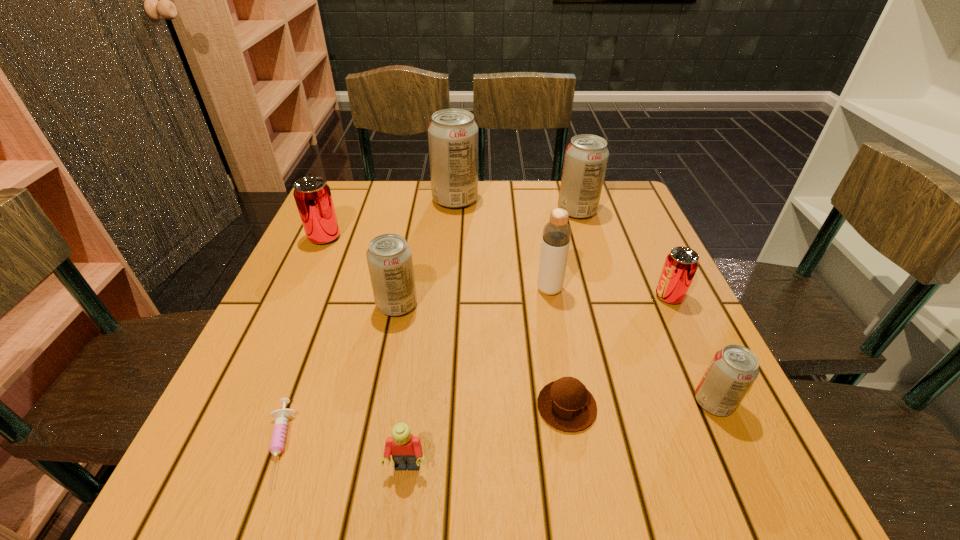
At what (x,y) coordinates should I click in order to perform the action: click on the tallest soda can. Please return your answer as a coordinate pair (x, y). The height and width of the screenshot is (540, 960). Looking at the image, I should click on (452, 134).

In order to click on the tallest object in this screenshot , I will do coord(452,134).

Locate an element on the screen. The image size is (960, 540). the fifth shortest soda can is located at coordinates (586, 157).

Find the location of a particular element. This screenshot has height=540, width=960. the second gray soda can from right to left is located at coordinates coord(586,157).

Locate an element on the screen. gray bottle is located at coordinates (556, 236).

Identify the location of the third farthest gray soda can. This screenshot has height=540, width=960. (389, 257).

Locate an element on the screen. Image resolution: width=960 pixels, height=540 pixels. the left red soda can is located at coordinates (312, 195).

At what (x,y) coordinates should I click in order to perform the action: click on the eighth nearest object. Please return your answer as a coordinate pair (x, y). The width and height of the screenshot is (960, 540). Looking at the image, I should click on (312, 195).

What are the coordinates of `the right red soda can` in the screenshot? It's located at (681, 264).

What are the coordinates of `the nearer red soda can` in the screenshot? It's located at tap(681, 264).